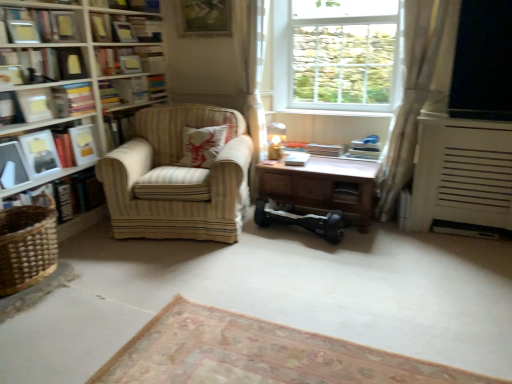
I want to click on vacant area that lies in front of white plastic radiator at right, so click(465, 260).